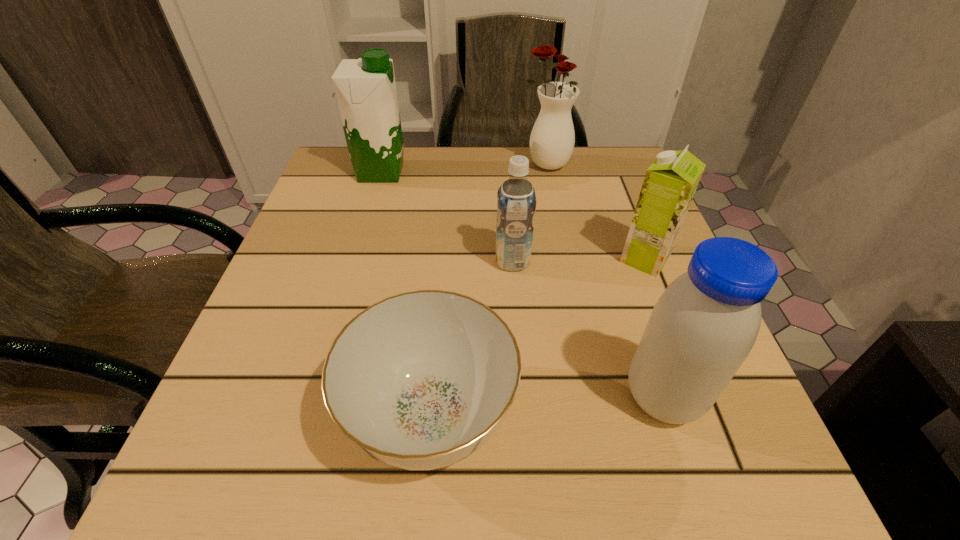
Identify the location of free space that satisfies the following two spatial constraints: 1. on the front-facing side of the leftmost soya milk; 2. on the back side of the chinaware. (309, 415).

At what (x,y) coordinates should I click in order to perform the action: click on free space that satisfies the following two spatial constraints: 1. on the front-facing side of the chinaware; 2. on the right side of the leftmost soya milk. Please return your answer as a coordinate pair (x, y). This screenshot has width=960, height=540. Looking at the image, I should click on (309, 415).

The width and height of the screenshot is (960, 540). In order to click on free location that satisfies the following two spatial constraints: 1. on the front-facing side of the chinaware; 2. on the left side of the farthest soya milk in this screenshot , I will do `click(309, 415)`.